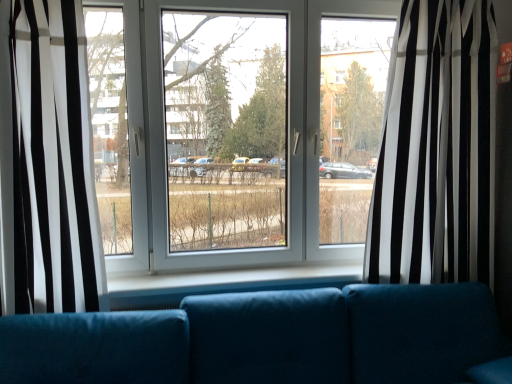
Question: Considering their positions, is white sheer curtain at left, which is the 2th curtain from right to left, located in front of or behind black/white striped curtain at center, which is the 2th curtain from left to right?

Choices:
 (A) front
 (B) behind

Answer: (A)

Question: From the image's perspective, is white sheer curtain at left, which is the 2th curtain from right to left, located above or below black/white striped curtain at center, the 1th curtain in the right-to-left sequence?

Choices:
 (A) above
 (B) below

Answer: (B)

Question: Estimate the real-world distances between objects in this image. Which object is closer to the black/white striped curtain at center, which is the 2th curtain from left to right?

Choices:
 (A) teal fabric couch at center
 (B) white sheer curtain at left, which is counted as the first curtain, starting from the left

Answer: (A)

Question: Which object is the farthest from the black/white striped curtain at center, the 1th curtain in the right-to-left sequence?

Choices:
 (A) white sheer curtain at left, which is counted as the first curtain, starting from the left
 (B) teal fabric couch at center

Answer: (A)